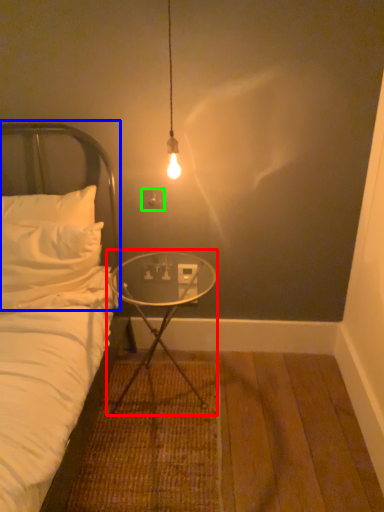
Question: Estimate the real-world distances between objects in this image. Which object is farther from table (highlighted by a red box), headboard (highlighted by a blue box) or electric outlet (highlighted by a green box)?

Choices:
 (A) headboard
 (B) electric outlet

Answer: (A)